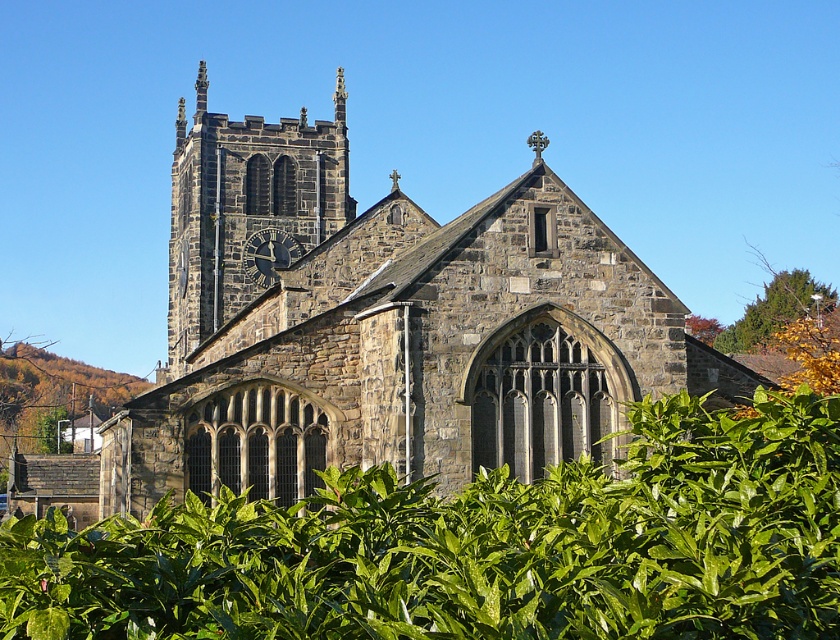
Question: Which of these objects is positioned farthest from the stone church at center?

Choices:
 (A) dark gray stone clock at center-left
 (B) dark gray stone clock tower at upper left

Answer: (A)

Question: Based on their relative distances, which object is farther from the stone church at center?

Choices:
 (A) dark gray stone clock at center-left
 (B) dark gray stone clock tower at upper left

Answer: (A)

Question: Does dark gray stone clock tower at upper left appear under dark gray stone clock at center-left?

Choices:
 (A) no
 (B) yes

Answer: (A)

Question: Which point is closer to the camera taking this photo?

Choices:
 (A) (334, 317)
 (B) (252, 243)

Answer: (A)

Question: Can you confirm if stone church at center is thinner than dark gray stone clock at center-left?

Choices:
 (A) yes
 (B) no

Answer: (B)

Question: Is stone church at center smaller than dark gray stone clock tower at upper left?

Choices:
 (A) yes
 (B) no

Answer: (B)